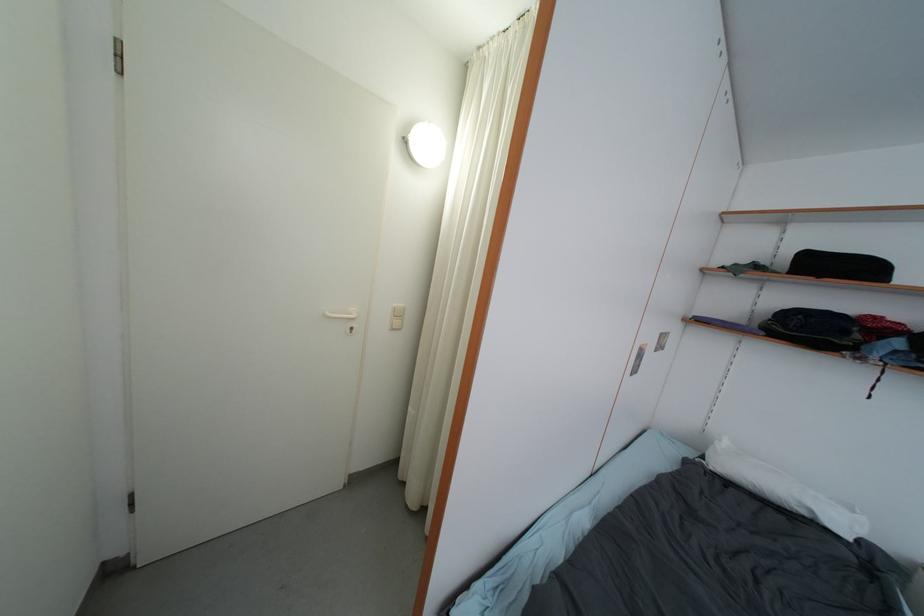
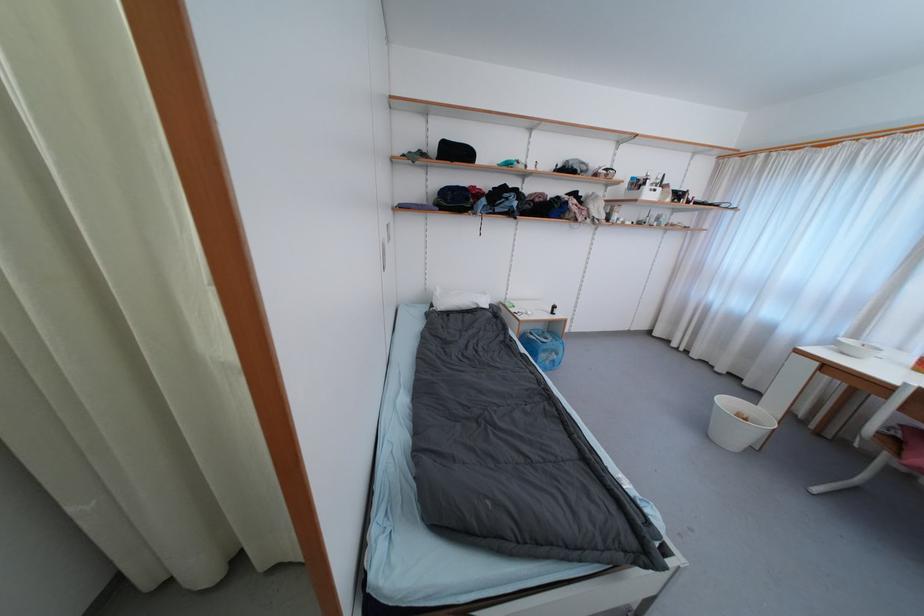
Locate, in the second image, the point that corresponds to [881,321] in the first image.

(478, 190)